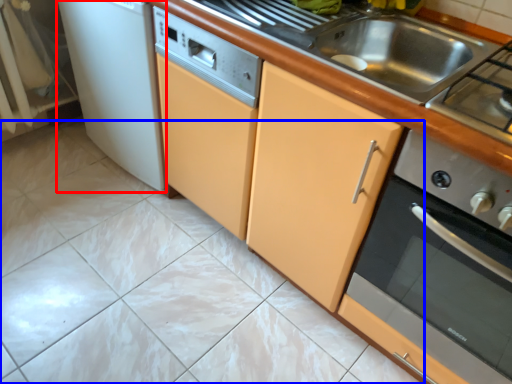
Question: Among these objects, which one is nearest to the camera, home appliance (highlighted by a red box) or ceramic tile (highlighted by a blue box)?

Choices:
 (A) home appliance
 (B) ceramic tile

Answer: (B)